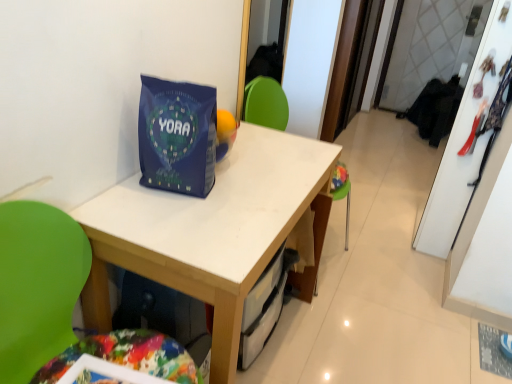
The width and height of the screenshot is (512, 384). Describe the element at coordinates (177, 136) in the screenshot. I see `blue matte gift bag at center` at that location.

The width and height of the screenshot is (512, 384). What are the coordinates of `green plastic chair at center` in the screenshot? It's located at (38, 285).

From a real-world perspective, is blue matte gift bag at center under green plastic chair at center?

Incorrect, from a real-world perspective, blue matte gift bag at center is higher than green plastic chair at center.

Is there a large distance between blue matte gift bag at center and green plastic chair at center?

They are positioned close to each other.

From the image's perspective, is blue matte gift bag at center above green plastic chair at center?

Correct, blue matte gift bag at center appears higher than green plastic chair at center in the image.

Is green plastic chair at center in front of or behind blue matte gift bag at center in the image?

Clearly, green plastic chair at center is in front of blue matte gift bag at center.

Considering the sizes of green plastic chair at center and blue matte gift bag at center in the image, is green plastic chair at center bigger or smaller than blue matte gift bag at center?

Clearly, green plastic chair at center is larger in size than blue matte gift bag at center.

Is green plastic chair at center taller or shorter than blue matte gift bag at center?

In the image, green plastic chair at center appears to be taller than blue matte gift bag at center.

Is green plastic chair at center turned away from blue matte gift bag at center?

green plastic chair at center does not have its back to blue matte gift bag at center.

Who is bigger, white matte table at center or green plastic chair at center?

Bigger between the two is white matte table at center.

Is white matte table at center directly adjacent to green plastic chair at center?

No, white matte table at center is not next to green plastic chair at center.

From a real-world perspective, between white matte table at center and green plastic chair at center, who is vertically lower?

In real-world perspective, white matte table at center is lower.

From the image's perspective, which one is positioned lower, blue matte gift bag at center or white matte table at center?

From the image's view, white matte table at center is below.

Is blue matte gift bag at center turned away from white matte table at center?

No, blue matte gift bag at center is not facing the opposite direction of white matte table at center.

Which is more to the right, blue matte gift bag at center or white matte table at center?

white matte table at center.

Is point (2, 242) behind point (330, 165)?

No, (2, 242) is closer to viewer.

Considering the sizes of green plastic chair at center and white matte table at center in the image, is green plastic chair at center taller or shorter than white matte table at center?

Clearly, green plastic chair at center is taller compared to white matte table at center.

Consider the image. From the image's perspective, is green plastic chair at center beneath white matte table at center?

Correct, green plastic chair at center appears lower than white matte table at center in the image.

Consider the image. Measure the distance from green plastic chair at center to white matte table at center.

green plastic chair at center and white matte table at center are 32.58 centimeters apart.

What's the angular difference between white matte table at center and blue matte gift bag at center's facing directions?

13.8 degrees.

Considering the sizes of objects white matte table at center and blue matte gift bag at center in the image provided, who is thinner, white matte table at center or blue matte gift bag at center?

With smaller width is blue matte gift bag at center.

Is white matte table at center further to camera compared to blue matte gift bag at center?

No, white matte table at center is closer to the viewer.

I want to click on chair that appears in front of the blue matte gift bag at center, so click(x=38, y=285).

Where is `gift bag above the green plastic chair at center (from the image's perspective)`? Image resolution: width=512 pixels, height=384 pixels. gift bag above the green plastic chair at center (from the image's perspective) is located at coordinates (177, 136).

Based on their spatial positions, is blue matte gift bag at center or green plastic chair at center further from white matte table at center?

green plastic chair at center is further to white matte table at center.

Looking at the image, which one is located closer to green plastic chair at center, white matte table at center or blue matte gift bag at center?

white matte table at center is positioned closer to the anchor green plastic chair at center.

Based on their spatial positions, is blue matte gift bag at center or white matte table at center further from green plastic chair at center?

blue matte gift bag at center.

Looking at the image, which one is located further to white matte table at center, green plastic chair at center or blue matte gift bag at center?

green plastic chair at center is further to white matte table at center.

When comparing their distances from blue matte gift bag at center, does green plastic chair at center or white matte table at center seem closer?

Based on the image, white matte table at center appears to be nearer to blue matte gift bag at center.

Which object lies further to the anchor point blue matte gift bag at center, white matte table at center or green plastic chair at center?

green plastic chair at center.

Identify the location of table that lies between blue matte gift bag at center and green plastic chair at center from top to bottom. (213, 231).